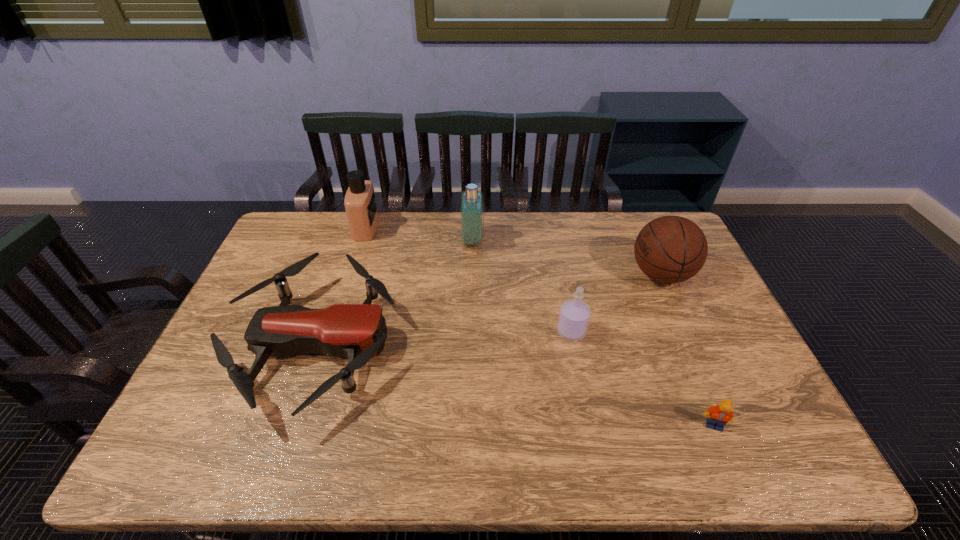
Identify the location of free point between the fourth tallest object and the leftmost perfume. The width and height of the screenshot is (960, 540). (468, 280).

Where is `vacant area that lies between the basketball and the second perfume from left to right`? The width and height of the screenshot is (960, 540). vacant area that lies between the basketball and the second perfume from left to right is located at coordinates (566, 258).

Locate an element on the screen. This screenshot has width=960, height=540. unoccupied position between the leftmost perfume and the second perfume from left to right is located at coordinates (420, 234).

The height and width of the screenshot is (540, 960). What are the coordinates of `free area in between the drone and the leftmost perfume` in the screenshot? It's located at (341, 286).

This screenshot has height=540, width=960. Identify the location of free space between the third object from left to right and the drone. (394, 292).

Where is `blank region between the third shortest object and the drone`? blank region between the third shortest object and the drone is located at coordinates (444, 338).

I want to click on vacant region between the basketball and the Lego, so click(687, 350).

Select which object appears as the closest to the drone. Please provide its 2D coordinates. Your answer should be formatted as a tuple, i.e. [(x, y)], where the tuple contains the x and y coordinates of a point satisfying the conditions above.

[(360, 204)]

Where is `object that is the fifth closest to the drone`? This screenshot has width=960, height=540. object that is the fifth closest to the drone is located at coordinates (719, 415).

Locate which perfume is the second closest to the leftmost perfume. Please provide its 2D coordinates. Your answer should be formatted as a tuple, i.e. [(x, y)], where the tuple contains the x and y coordinates of a point satisfying the conditions above.

[(574, 316)]